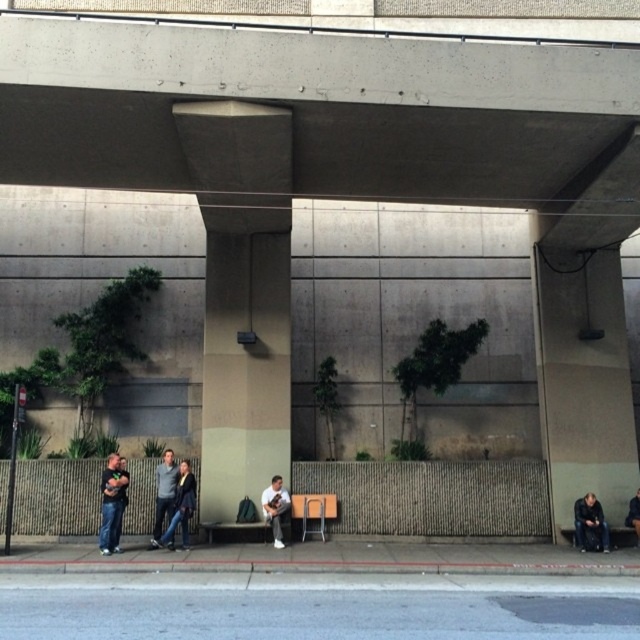
Question: Which of the following is the farthest from the observer?

Choices:
 (A) (600, 545)
 (B) (264, 490)
 (C) (179, 492)

Answer: (B)

Question: Does brown concrete pillar at center lie in front of light gray fabric jacket at center?

Choices:
 (A) no
 (B) yes

Answer: (A)

Question: Is dark gray pants at lower right closer to camera compared to dark gray hoodie at lower left?

Choices:
 (A) no
 (B) yes

Answer: (A)

Question: Is dark gray pants at lower right below dark blue jacket at lower right?

Choices:
 (A) no
 (B) yes

Answer: (A)

Question: Which object is farther from the camera taking this photo?

Choices:
 (A) concrete at upper center
 (B) brown concrete pillar at center

Answer: (B)

Question: Which object appears farthest from the camera in this image?

Choices:
 (A) jeans at lower left
 (B) dark gray pants at lower right
 (C) concrete at upper center
 (D) dark gray sweater at center

Answer: (B)